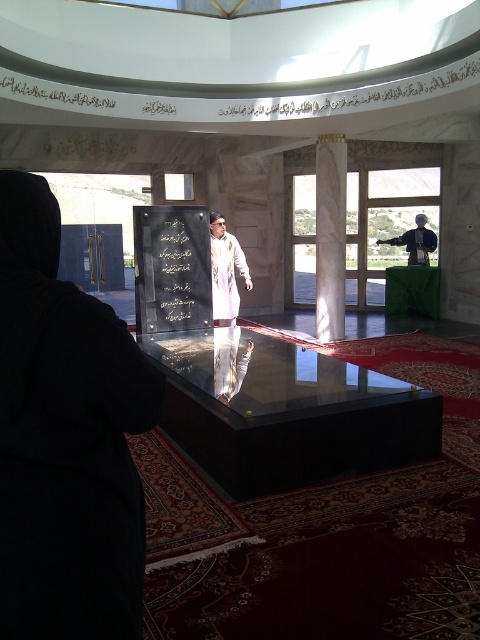
You are an architect visiting this space and want to place a new decorative item between the black polished stone plaque at center and the white marble column at center. Based on their positions, which object should the item be closer to?

The black polished stone plaque at center is to the left of the white marble column at center, so the new decorative item should be placed closer to the white marble column at center to maintain symmetry between the two objects.

You are an interior designer planning to place a new decorative item in the space. You have two options from the objects shown here. Which object, the black polished stone plaque at center or the black polished stone at center, would you choose if you want the item to occupy more space in the area?

The black polished stone plaque at center has a larger size compared to the black polished stone at center, so it would occupy more space in the area.